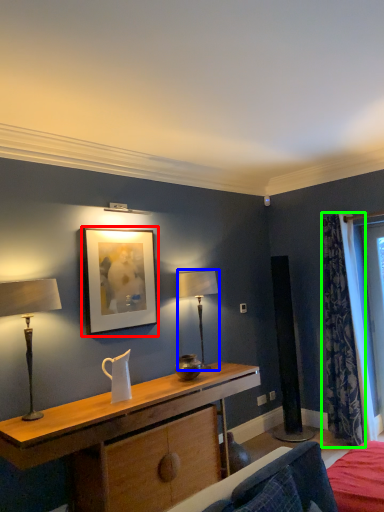
Question: Based on their relative distances, which object is nearer to picture frame (highlighted by a red box)? Choose from table lamp (highlighted by a blue box) and curtain (highlighted by a green box).

Choices:
 (A) table lamp
 (B) curtain

Answer: (A)